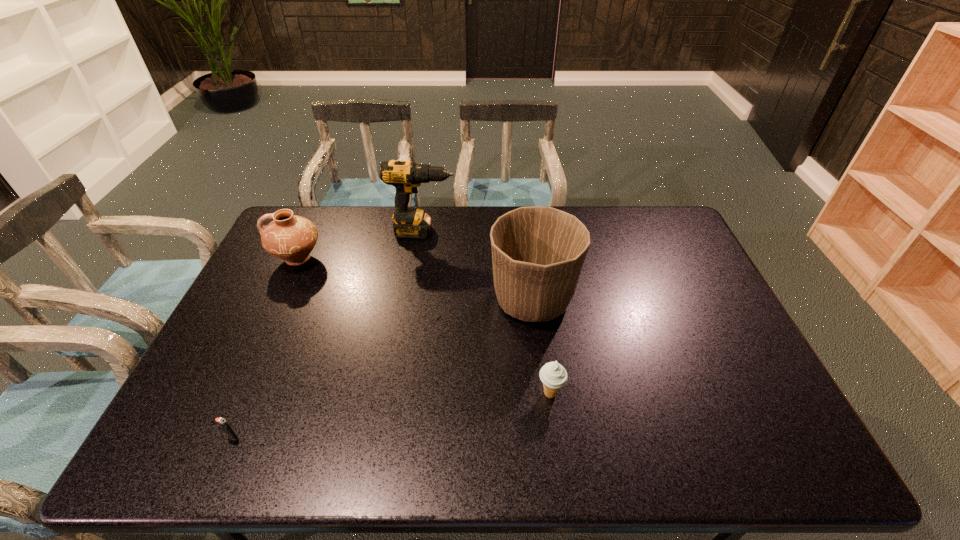
I want to click on the farthest object, so click(405, 176).

The image size is (960, 540). What are the coordinates of `the third object from left to right` in the screenshot? It's located at (405, 176).

I want to click on flowerpot, so click(538, 253).

This screenshot has width=960, height=540. Identify the location of the third shortest object. (289, 237).

This screenshot has width=960, height=540. Find the location of `the second shortest object`. the second shortest object is located at coordinates (553, 375).

Find the location of `the fourth farthest object`. the fourth farthest object is located at coordinates (553, 375).

Where is `igniter`? igniter is located at coordinates (222, 422).

Identify the location of the nearest object. This screenshot has width=960, height=540. click(x=222, y=422).

At what (x,y) coordinates should I click in order to perform the action: click on free space located 0.110m at the tip of the drill. Please return your answer as a coordinate pair (x, y). Looking at the image, I should click on (487, 232).

Identify the location of vacant space situated 0.060m on the back of the flowerpot. This screenshot has width=960, height=540. (527, 259).